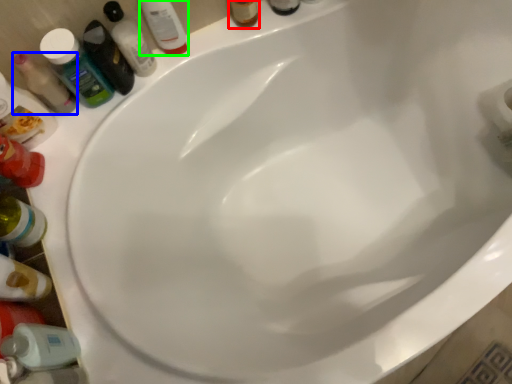
Question: Which is farther away from toiletry (highlighted by a red box)? mouthwash (highlighted by a blue box) or mouthwash (highlighted by a green box)?

Choices:
 (A) mouthwash
 (B) mouthwash

Answer: (A)